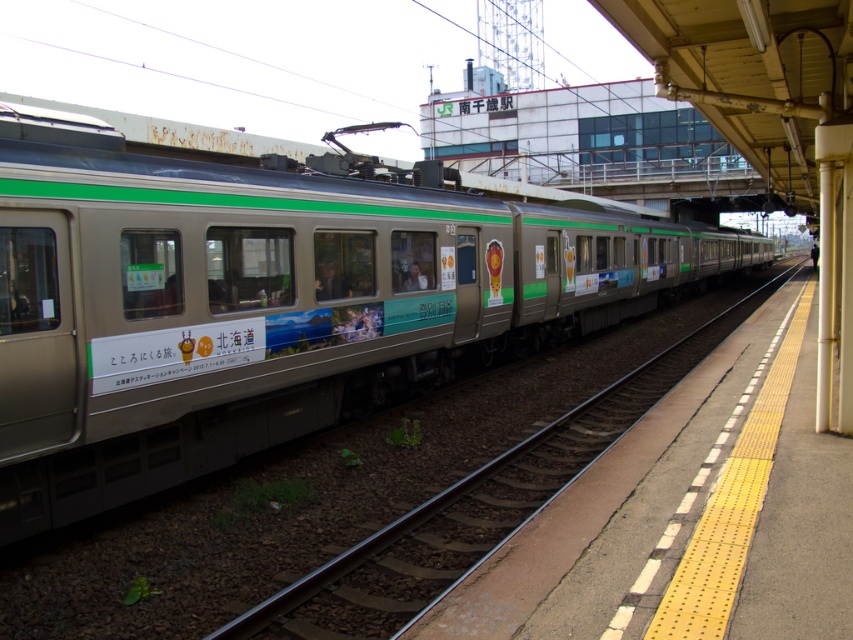
Question: Which of the following is the closest to the observer?

Choices:
 (A) (555, 484)
 (B) (210, 429)

Answer: (B)

Question: Can you confirm if metallic silver train at center is thinner than metallic train track at center?

Choices:
 (A) no
 (B) yes

Answer: (A)

Question: Which object appears farthest from the camera in this image?

Choices:
 (A) metallic silver train at center
 (B) metallic train track at center

Answer: (A)

Question: Which point is closer to the camera taking this photo?

Choices:
 (A) (393, 180)
 (B) (688, 339)

Answer: (A)

Question: Is metallic silver train at center closer to camera compared to metallic train track at center?

Choices:
 (A) no
 (B) yes

Answer: (A)

Question: Does metallic silver train at center appear on the right side of metallic train track at center?

Choices:
 (A) yes
 (B) no

Answer: (A)